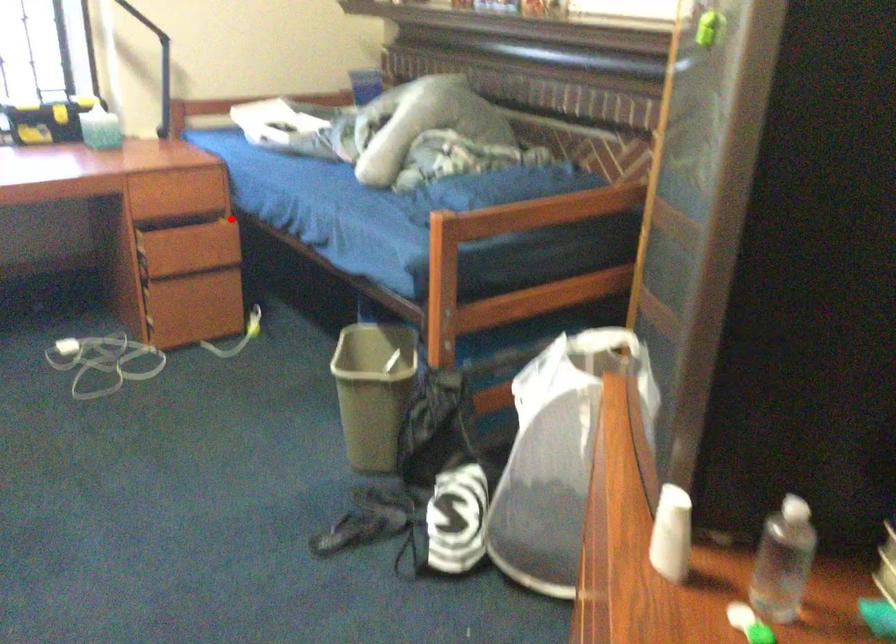
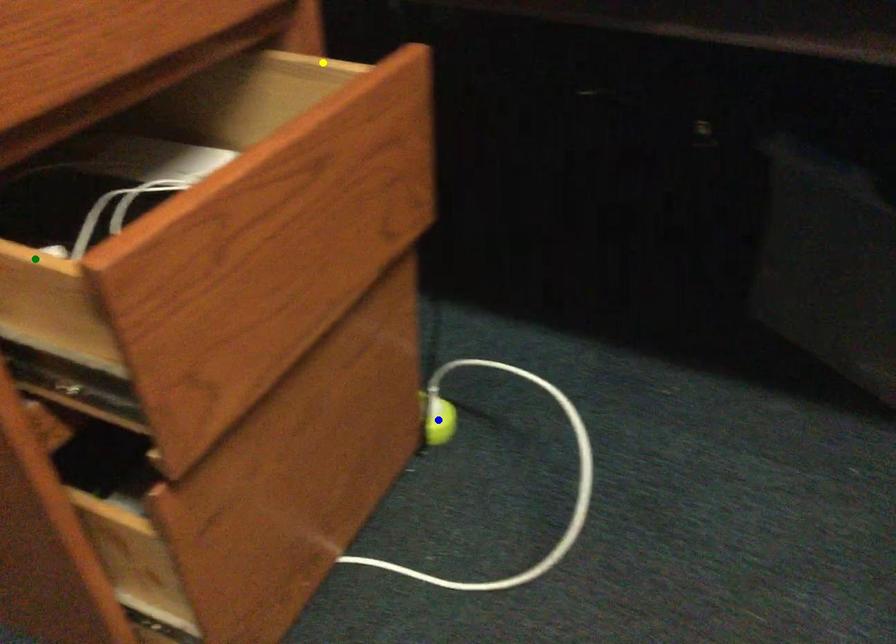
Question: I am providing you with two images of the same scene from different viewpoints. A red point is marked on the first image. You are given multiple points on the second image. Which spot in image 2 lines up with the point in image 1?

Choices:
 (A) blue point
 (B) yellow point
 (C) green point

Answer: (B)